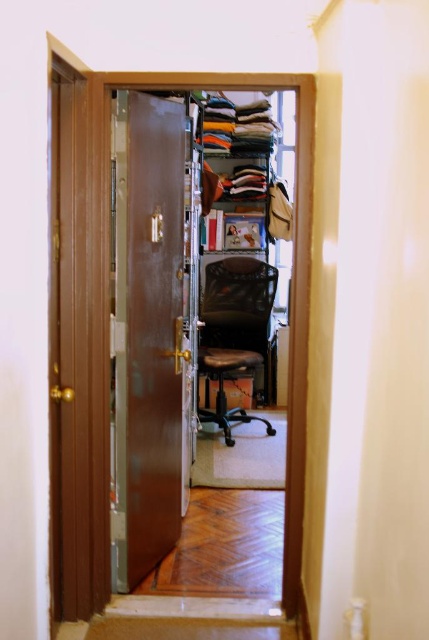
Based on the photo, can you confirm if brown wood door at left is bigger than brown polished wood door at center?

Incorrect, brown wood door at left is not larger than brown polished wood door at center.

Is brown wood door at left thinner than brown polished wood door at center?

Indeed, brown wood door at left has a lesser width compared to brown polished wood door at center.

This screenshot has width=429, height=640. Describe the element at coordinates (79, 340) in the screenshot. I see `brown wood door at left` at that location.

Find the location of a particular element. brown wood door at left is located at coordinates (79, 340).

This screenshot has width=429, height=640. Describe the element at coordinates (151, 333) in the screenshot. I see `brown polished wood door at center` at that location.

Is brown polished wood door at center smaller than black mesh swivel chair at center?

Yes, brown polished wood door at center is smaller than black mesh swivel chair at center.

Describe the element at coordinates (151, 333) in the screenshot. I see `brown polished wood door at center` at that location.

The width and height of the screenshot is (429, 640). I want to click on brown polished wood door at center, so click(151, 333).

Find the location of `matte brown closet at center`. matte brown closet at center is located at coordinates (190, 310).

You are a GUI agent. You are given a task and a screenshot of the screen. Output one action in this format:
    pyautogui.click(x=<x>, y=<y>)
    Task: Click on the matte brown closet at center
    The image size is (429, 640).
    Given the screenshot: What is the action you would take?
    (190, 310)